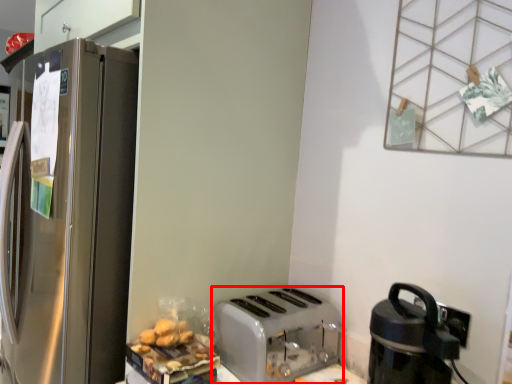
Question: Considering the relative positions of toaster (annotated by the red box) and kitchen appliance in the image provided, where is toaster (annotated by the red box) located with respect to the staircase?

Choices:
 (A) left
 (B) right

Answer: (A)